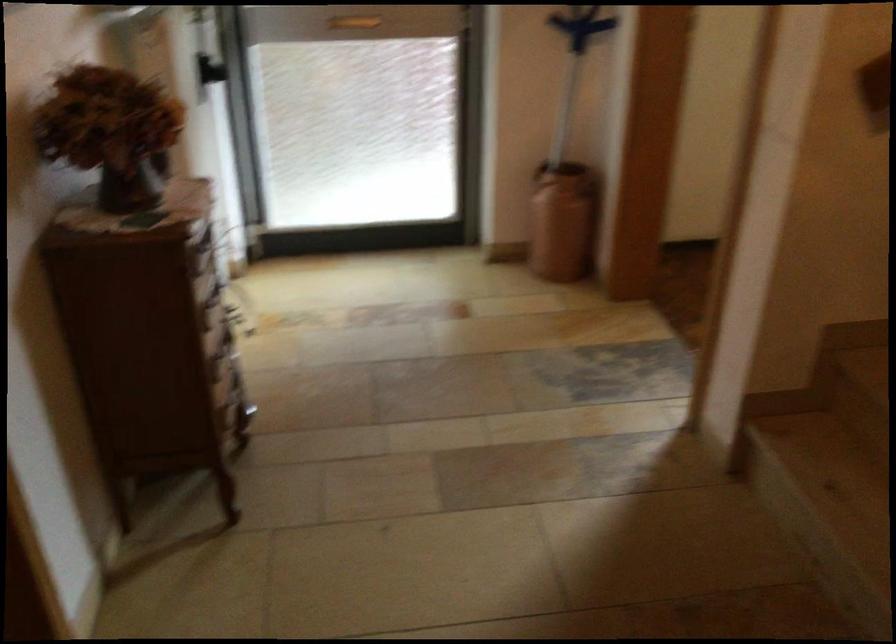
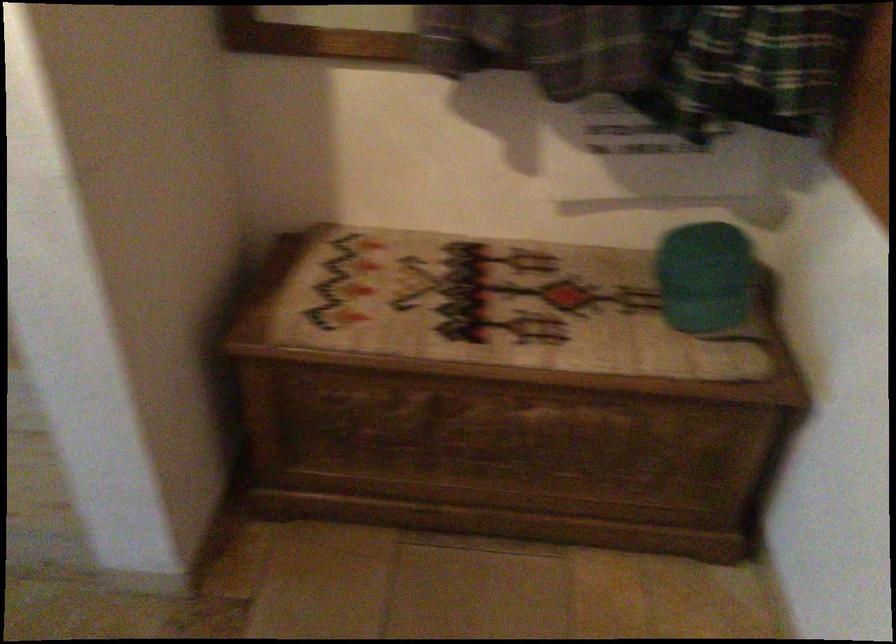
How did the camera likely rotate?

The camera rotated toward right-down.